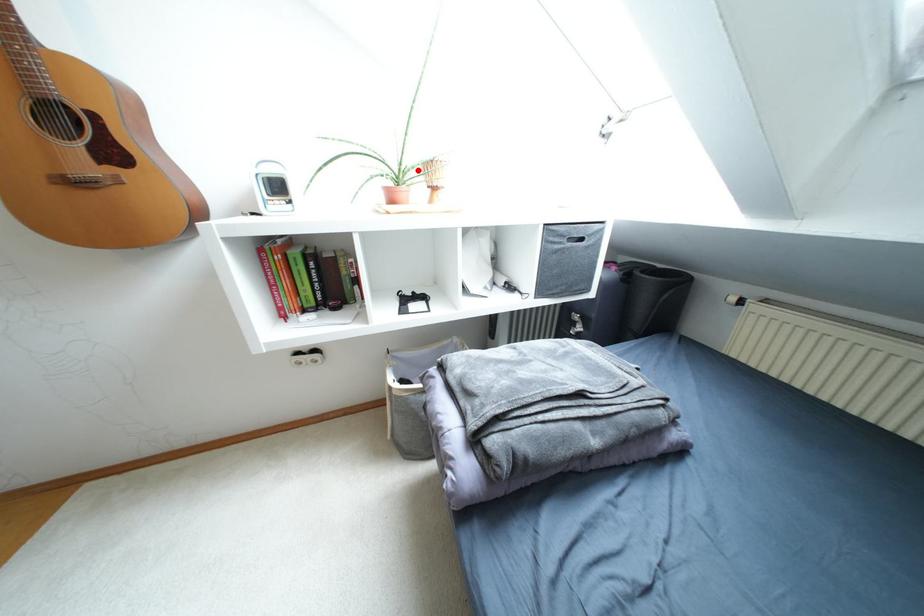
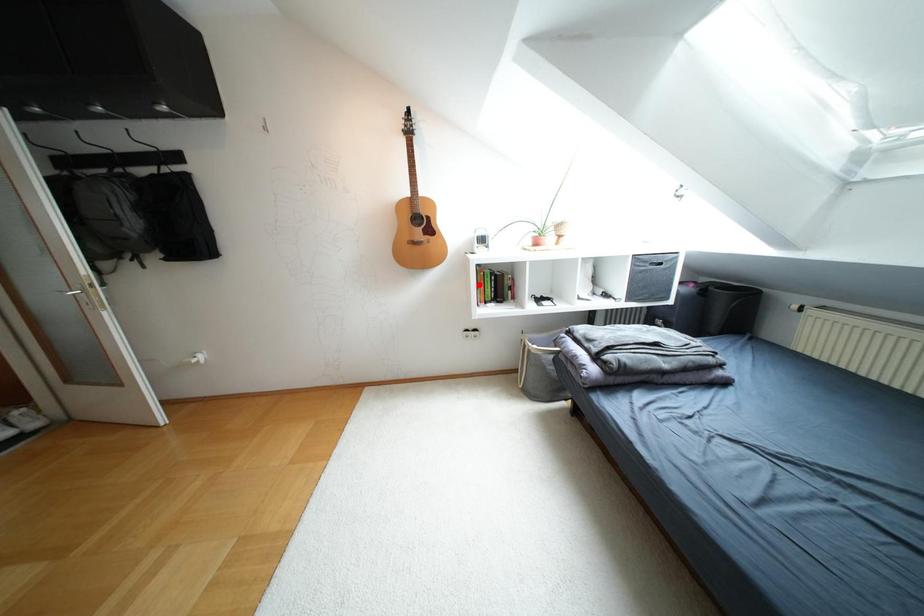
I am providing you with two images of the same scene from different viewpoints. A red point is marked on the first image and another point is marked on the second image. Is the red point in image1 aligned with the point shown in image2?

No